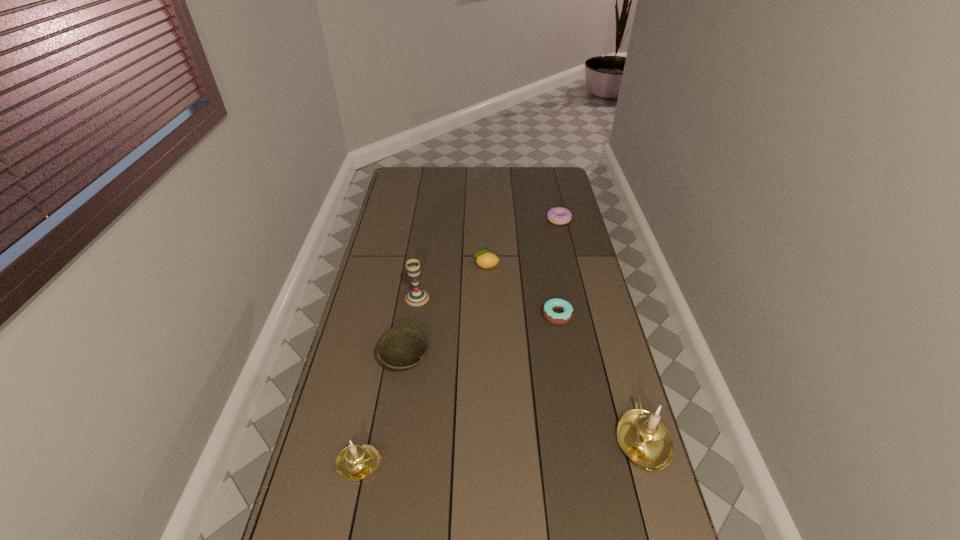
Image resolution: width=960 pixels, height=540 pixels. In order to click on vacant space located 0.120m with leaves positioned above the second farthest object in this screenshot , I will do `click(443, 266)`.

Where is `blank space located on the right of the chalice`? This screenshot has width=960, height=540. blank space located on the right of the chalice is located at coordinates (461, 298).

The height and width of the screenshot is (540, 960). I want to click on candle holder present at the left edge, so click(357, 461).

At what (x,y) coordinates should I click in order to perform the action: click on bowl situated at the left edge. Please return your answer as a coordinate pair (x, y). Image resolution: width=960 pixels, height=540 pixels. Looking at the image, I should click on 403,347.

Locate an element on the screen. candle holder at the right edge is located at coordinates (643, 436).

Image resolution: width=960 pixels, height=540 pixels. In the image, there is a desktop. In order to click on vacant space at the far edge in this screenshot , I will do `click(438, 170)`.

At what (x,y) coordinates should I click in order to perform the action: click on vacant space at the near edge. Please return your answer as a coordinate pair (x, y). Image resolution: width=960 pixels, height=540 pixels. Looking at the image, I should click on (470, 510).

Locate an element on the screen. The image size is (960, 540). vacant region at the left edge of the desktop is located at coordinates (400, 215).

At what (x,y) coordinates should I click in order to perform the action: click on vacant area at the right edge of the desktop. Please return your answer as a coordinate pair (x, y). The width and height of the screenshot is (960, 540). Looking at the image, I should click on (573, 221).

Image resolution: width=960 pixels, height=540 pixels. What are the coordinates of `blank space at the far right corner of the desktop` in the screenshot? It's located at (538, 173).